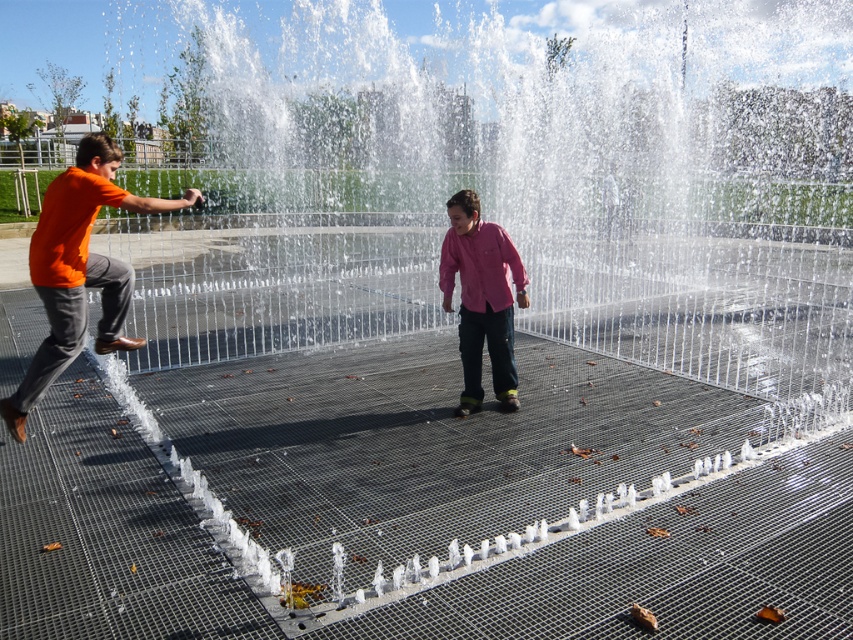
You are a photographer at the water feature. You want to capture a photo where both the orange matte shirt at left and the pink matte shirt at center are clearly visible. Based on their positions, which child should be closer to the camera?

The orange matte shirt at left is in front of the pink matte shirt at center, so the child in the orange matte shirt at left is closer to the camera.

You are a photographer trying to capture both the orange matte shirt at left and the pink matte shirt at center in a single frame. Based on their positions, which child should you position closer to the left side of your camera viewfinder?

The orange matte shirt at left is to the left of the pink matte shirt at center, so you should position the orange matte shirt at left closer to the left side of your camera viewfinder.